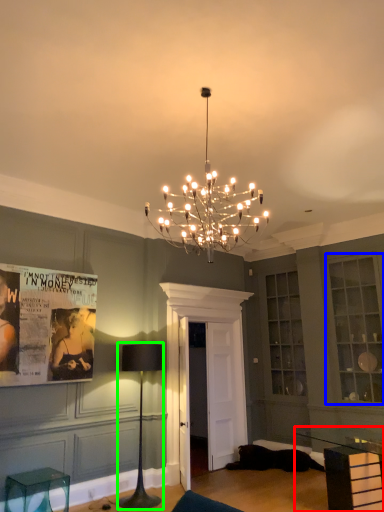
Question: Estimate the real-world distances between objects in this image. Which object is closer to table (highlighted by a red box), cabinetry (highlighted by a blue box) or table lamp (highlighted by a green box)?

Choices:
 (A) cabinetry
 (B) table lamp

Answer: (A)